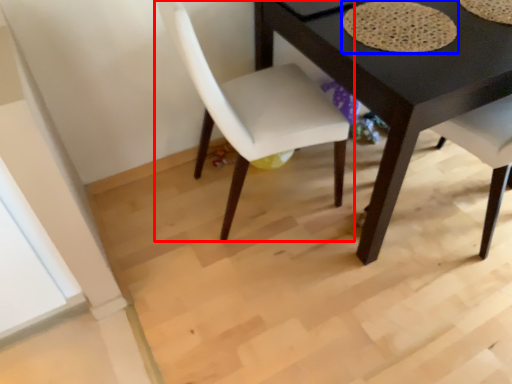
Question: Which of the following is the closest to the observer, chair (highlighted by a red box) or mat (highlighted by a blue box)?

Choices:
 (A) chair
 (B) mat

Answer: (A)